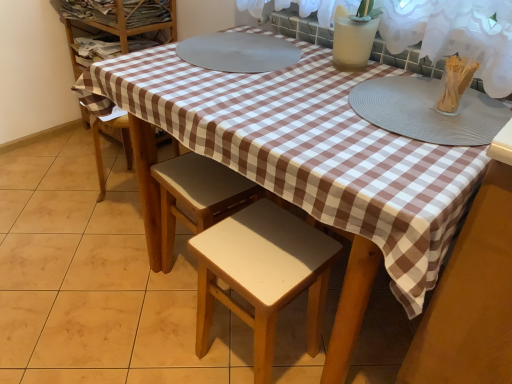
Find the location of a particular element. The height and width of the screenshot is (384, 512). vacant space positioned to the left of white matte stool at lower center, which ranks as the first stool in front-to-back order is located at coordinates coord(168,340).